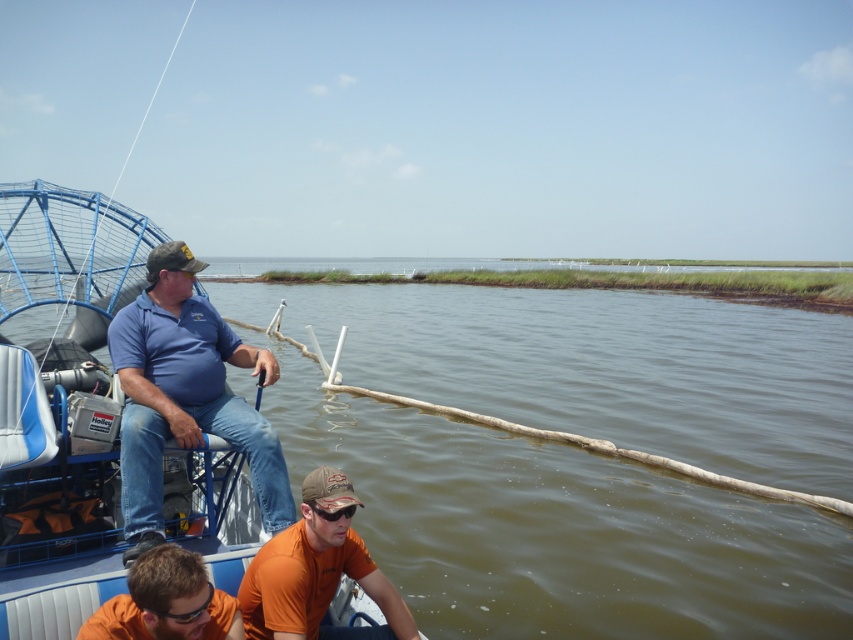
Question: Among these objects, which one is nearest to the camera?

Choices:
 (A) orange cotton shirt at lower center
 (B) blue denim jeans at left

Answer: (A)

Question: Does blue denim jeans at left lie behind orange cotton shirt at lower center?

Choices:
 (A) yes
 (B) no

Answer: (A)

Question: Which point appears farthest from the camera in this image?

Choices:
 (A) (143, 474)
 (B) (161, 634)
 (C) (291, 380)
 (D) (318, 476)

Answer: (C)

Question: Which of the following is the farthest from the observer?

Choices:
 (A) click(186, 300)
 (B) click(529, 310)

Answer: (B)

Question: Does brown murky water at center come behind blue denim jeans at left?

Choices:
 (A) no
 (B) yes

Answer: (B)

Question: Is the position of blue denim jeans at left more distant than that of orange matte shirt at lower center?

Choices:
 (A) yes
 (B) no

Answer: (A)